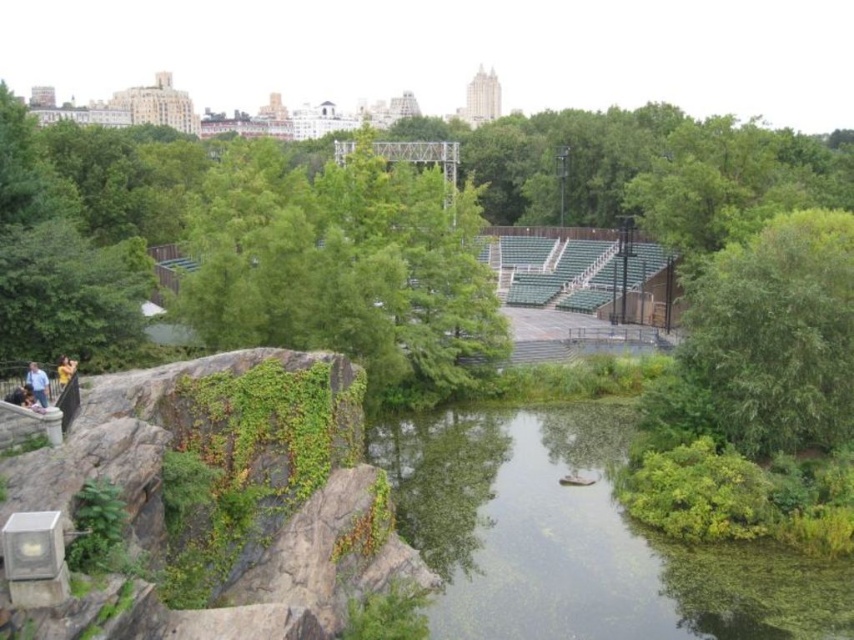
Question: Is green leafy tree at center bigger than yellow fabric at lower left?

Choices:
 (A) no
 (B) yes

Answer: (B)

Question: Does blue shirt at left have a lesser width compared to yellow fabric at lower left?

Choices:
 (A) yes
 (B) no

Answer: (A)

Question: Observing the image, what is the correct spatial positioning of green algae-covered water at center in reference to yellow fabric at lower left?

Choices:
 (A) below
 (B) above

Answer: (A)

Question: Which of the following is the closest to the observer?

Choices:
 (A) blue shirt at left
 (B) green leafy tree at center

Answer: (A)

Question: Estimate the real-world distances between objects in this image. Which object is farther from the blue shirt at left?

Choices:
 (A) yellow fabric at lower left
 (B) green leafy tree at center-right

Answer: (B)

Question: Which object is farther from the camera taking this photo?

Choices:
 (A) green leafy tree at center
 (B) green leafy tree at center-right

Answer: (A)